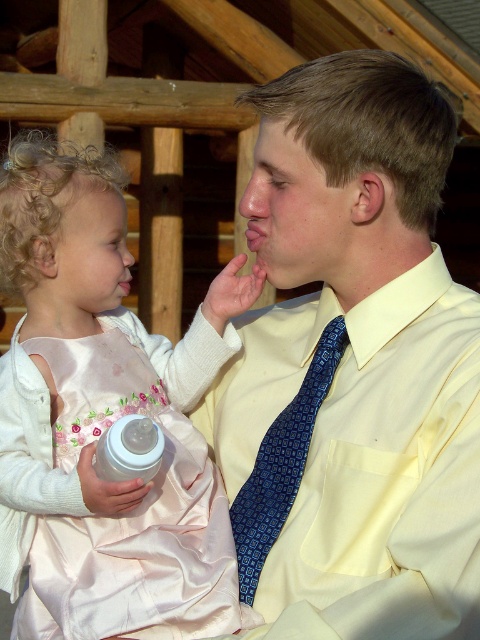
Can you confirm if yellow smooth shirt at center is smaller than pink satin dress at center?

Incorrect, yellow smooth shirt at center is not smaller in size than pink satin dress at center.

Is yellow smooth shirt at center wider than pink satin dress at center?

No.

Is point (273, 92) farther from camera compared to point (192, 596)?

Yes, it is behind point (192, 596).

Identify the location of yellow smooth shirt at center. Image resolution: width=480 pixels, height=640 pixels. (352, 365).

Does blue patterned tie at center appear under white plastic bottle at lower left?

Correct, blue patterned tie at center is located below white plastic bottle at lower left.

Which is more to the right, blue patterned tie at center or white plastic bottle at lower left?

blue patterned tie at center is more to the right.

Who is more distant from viewer, (343, 352) or (140, 468)?

Positioned behind is point (343, 352).

Identify the location of blue patterned tie at center. (282, 464).

Does yellow smooth shirt at center have a lesser width compared to blue patterned tie at center?

No.

Does point (342, 476) come farther from viewer compared to point (310, 422)?

No, it is in front of (310, 422).

Does point (248, 586) come in front of point (288, 456)?

Yes, point (248, 586) is in front of point (288, 456).

Identify the location of yellow smooth shirt at center. The height and width of the screenshot is (640, 480). (352, 365).